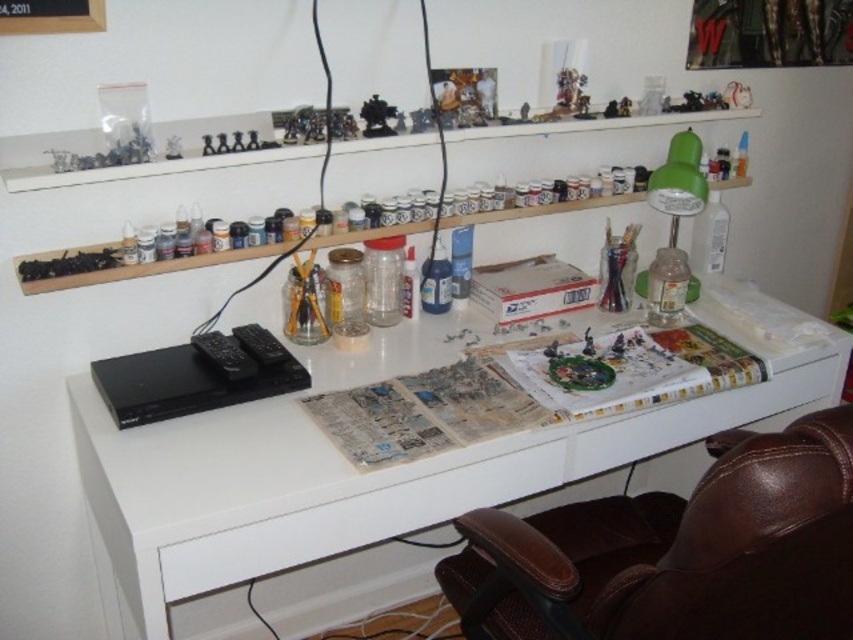
Question: Is the position of white matte computer desk at center more distant than that of brown leather swivel chair at lower right?

Choices:
 (A) yes
 (B) no

Answer: (A)

Question: Can you confirm if white matte computer desk at center is positioned above brown leather swivel chair at lower right?

Choices:
 (A) no
 (B) yes

Answer: (B)

Question: Among these objects, which one is farthest from the camera?

Choices:
 (A) white matte computer desk at center
 (B) brown leather swivel chair at lower right

Answer: (A)

Question: Is white matte computer desk at center wider than brown leather swivel chair at lower right?

Choices:
 (A) no
 (B) yes

Answer: (B)